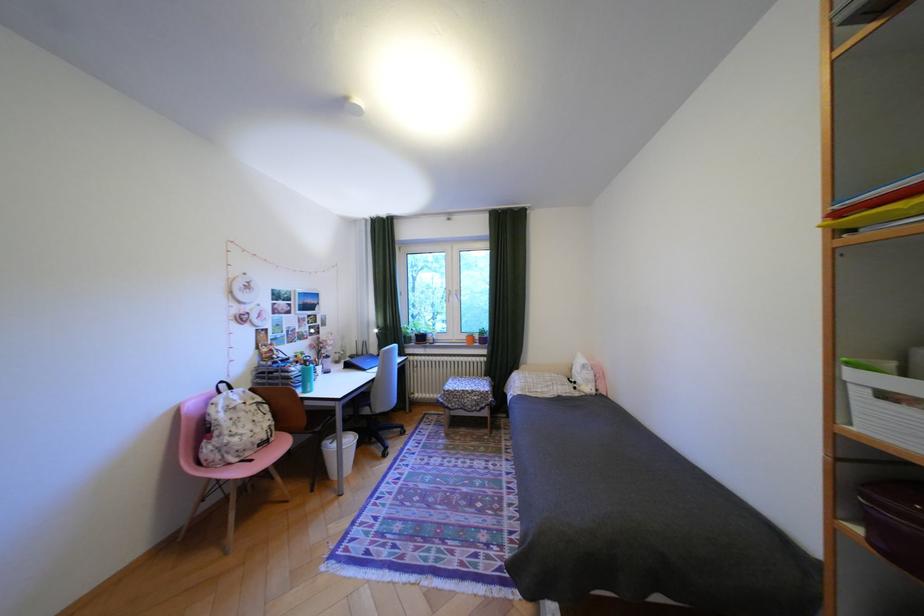
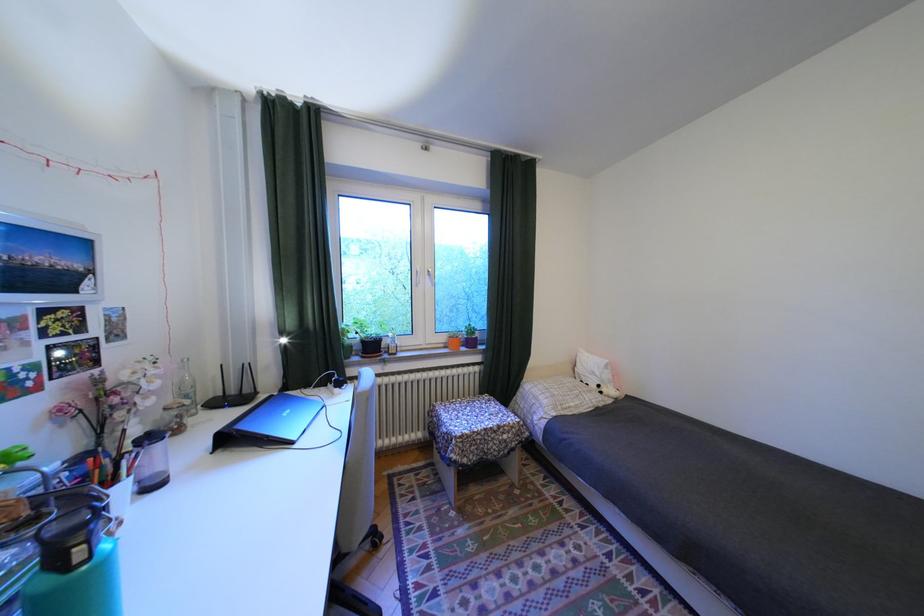
Based on the photo, in a continuous first-person perspective shot, in which direction is the camera moving?

The cameraman walked toward left, forward.